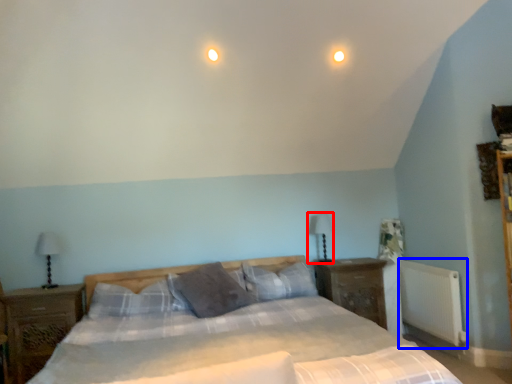
Question: Among these objects, which one is nearest to the camera, table lamp (highlighted by a red box) or radiator (highlighted by a blue box)?

Choices:
 (A) table lamp
 (B) radiator

Answer: (B)